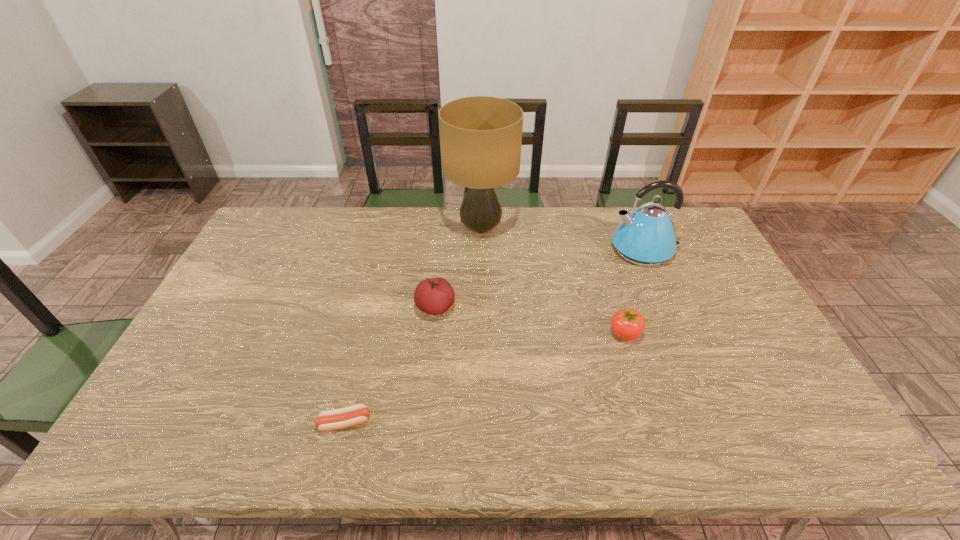
This screenshot has height=540, width=960. I want to click on free space located at the spout of the kettle, so click(x=548, y=249).

This screenshot has height=540, width=960. Identify the location of free space located at the spout of the kettle. (524, 249).

Find the location of a particular element. free space located on the front of the left tomato is located at coordinates (427, 386).

What are the coordinates of `vacant space situated 0.150m on the front of the shorter tomato` in the screenshot? It's located at (644, 396).

Find the location of a particular element. Image resolution: width=960 pixels, height=540 pixels. free space located on the right of the sausage is located at coordinates (460, 422).

I want to click on lampshade that is positioned at the far edge, so click(480, 136).

This screenshot has height=540, width=960. I want to click on kettle that is at the far edge, so click(x=646, y=237).

Identify the location of object present at the near edge. This screenshot has height=540, width=960. (328, 420).

Locate an element on the screen. The width and height of the screenshot is (960, 540). object that is at the right edge is located at coordinates (646, 237).

The image size is (960, 540). What are the coordinates of `object that is at the far right corner` in the screenshot? It's located at (646, 237).